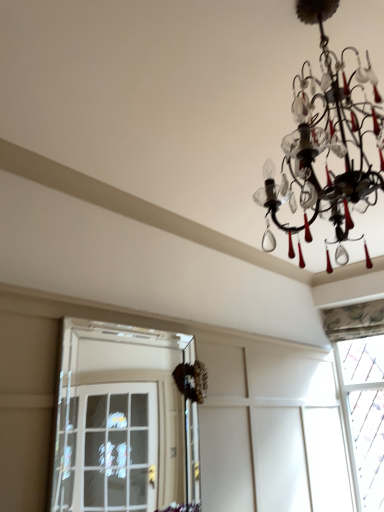
Question: In the image, is patterned fabric curtain at upper right, the first window in the right-to-left sequence, on the left side or the right side of black glass chandelier at upper right?

Choices:
 (A) right
 (B) left

Answer: (A)

Question: Is patterned fabric curtain at upper right, the first window in the right-to-left sequence, in front of or behind black glass chandelier at upper right in the image?

Choices:
 (A) front
 (B) behind

Answer: (B)

Question: Which is nearer to the black glass chandelier at upper right?

Choices:
 (A) patterned fabric curtain at upper right, which is the 2th window in left-to-right order
 (B) clear glass door at left, placed as the first window when sorted from front to back

Answer: (A)

Question: Which of these objects is positioned farthest from the patterned fabric curtain at upper right, the first window viewed from the back?

Choices:
 (A) black glass chandelier at upper right
 (B) clear glass door at left, placed as the first window when sorted from front to back

Answer: (A)